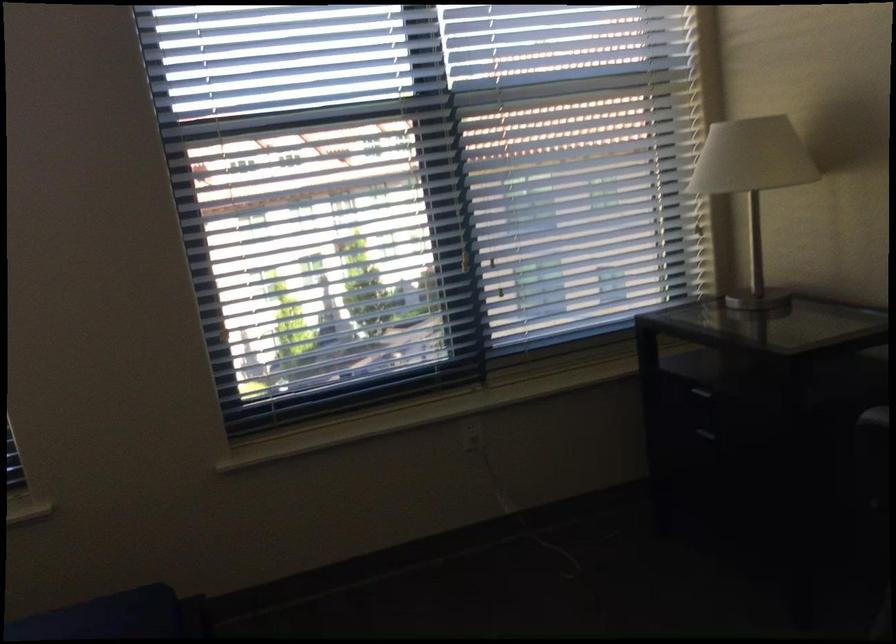
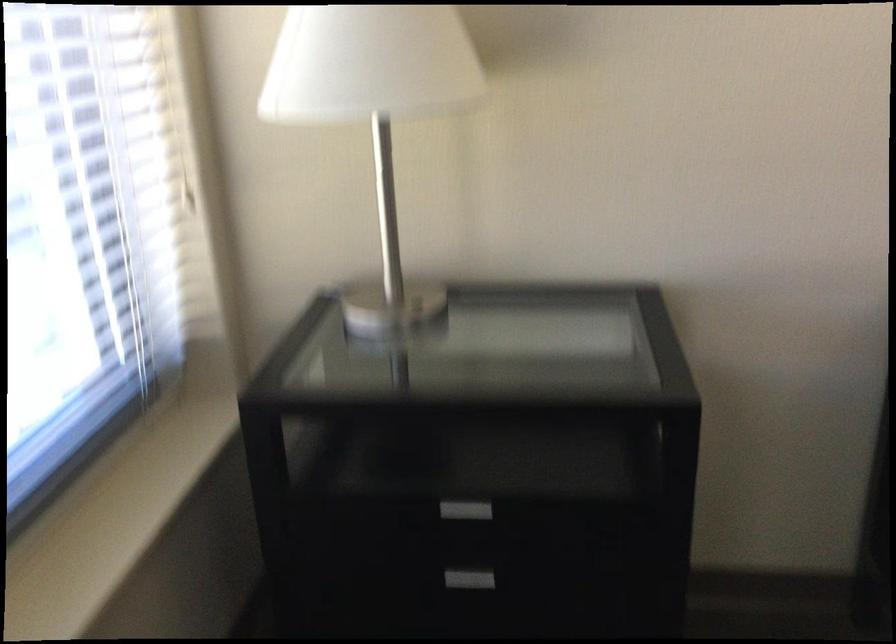
Where in the second image is the point corresponding to point (687, 449) from the first image?

(476, 569)